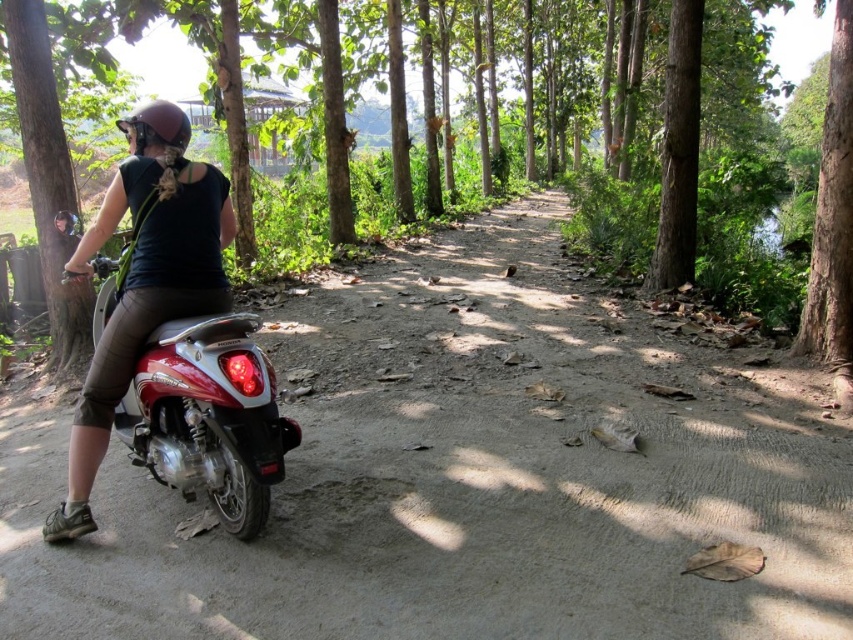
You are planning to take a photo of the dirt track at center and the brown wood tree at center. Which object should you focus on first if you want to capture both in a single frame without moving the camera?

The dirt track at center should be focused on first because it is smaller than the brown wood tree at center, allowing more room to include both in the frame.

You are navigating a drone along a dirt path in the image. The drone must fly from point A at coordinates point (838, 556) to point B at coordinates point (83, 464). Considering the scooter and rider are blocking part of the path, which point should the drone avoid to ensure a clear flight path?

The drone should avoid point B at coordinates point (83, 464) because point A at coordinates point (838, 556) is in front of it, and the scooter and rider might be blocking the path near point B.